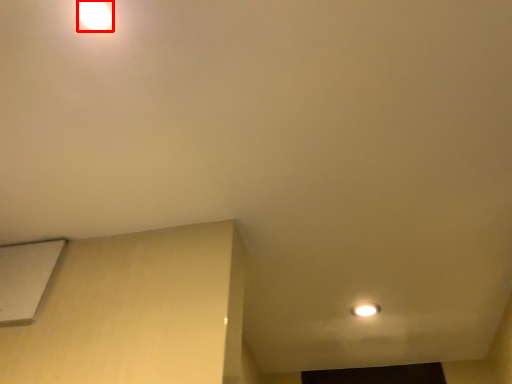
Question: From the image's perspective, what is the correct spatial positioning of lamp (annotated by the red box) in reference to lift?

Choices:
 (A) below
 (B) above

Answer: (B)